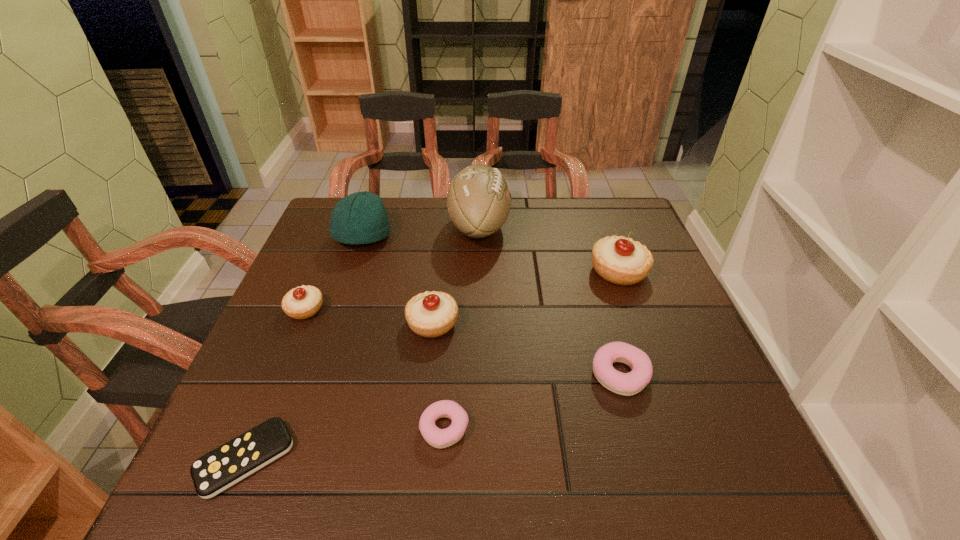
Where is `free spot between the sixth shortest object and the tallest object`? free spot between the sixth shortest object and the tallest object is located at coordinates (549, 249).

Find the location of a particular element. Image resolution: width=960 pixels, height=540 pixels. vacant space that is in between the nearest pastry and the beanie is located at coordinates (404, 333).

At what (x,y) coordinates should I click in order to perform the action: click on empty space between the farthest beige pastry and the beanie. Please return your answer as a coordinate pair (x, y). Looking at the image, I should click on (491, 254).

Locate an element on the screen. empty space between the farthest pastry and the nearer pink pastry is located at coordinates (532, 350).

You are a GUI agent. You are given a task and a screenshot of the screen. Output one action in this format:
    pyautogui.click(x=<x>, y=<y>)
    Task: Click on the free point between the remote control and the smallest beige pastry
    
    Given the screenshot: What is the action you would take?
    pyautogui.click(x=276, y=384)

I want to click on vacant space that is in between the smallest beige pastry and the fifth shortest object, so click(x=369, y=316).

Image resolution: width=960 pixels, height=540 pixels. I want to click on the sixth closest object to the shortest object, so click(x=627, y=384).

Where is `the closest object relative to the left pink pastry`? the closest object relative to the left pink pastry is located at coordinates (432, 314).

Where is `pastry that is the second closest to the remote control`? This screenshot has width=960, height=540. pastry that is the second closest to the remote control is located at coordinates (432, 314).

Locate which pastry ranks fifth in proximity to the tallest object. Please provide its 2D coordinates. Your answer should be formatted as a tuple, i.e. [(x, y)], where the tuple contains the x and y coordinates of a point satisfying the conditions above.

[(439, 438)]